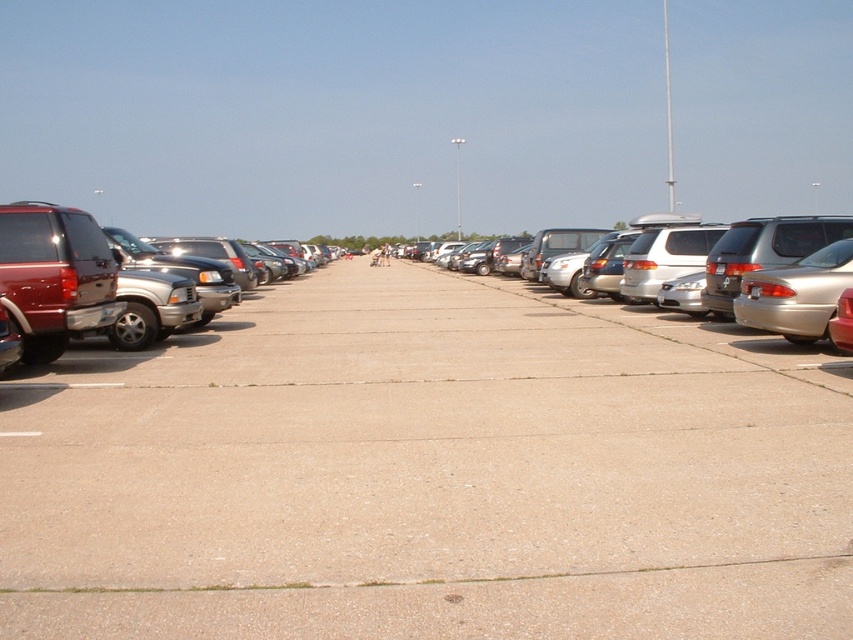
From the picture: Does silver metallic minivan at right have a lesser width compared to metallic silver sedan at right?

No.

Can you confirm if silver metallic minivan at right is positioned to the left of metallic silver sedan at right?

Incorrect, silver metallic minivan at right is not on the left side of metallic silver sedan at right.

Identify the location of silver metallic minivan at right. This screenshot has height=640, width=853. (779, 273).

What are the coordinates of `silver metallic minivan at right` in the screenshot? It's located at (779, 273).

Is gray concrete pavement at center behind metallic silver sedan at right?

No, gray concrete pavement at center is closer to the viewer.

Which of these two, gray concrete pavement at center or metallic silver sedan at right, stands shorter?

Standing shorter between the two is metallic silver sedan at right.

What do you see at coordinates (430, 474) in the screenshot?
I see `gray concrete pavement at center` at bounding box center [430, 474].

I want to click on gray concrete pavement at center, so tap(430, 474).

Between shiny metallic suv at left and metallic silver sedan at right, which one is positioned lower?

shiny metallic suv at left is below.

Is point (44, 205) farther from camera compared to point (750, 314)?

No, it is in front of (750, 314).

Find the location of a particular element. shiny metallic suv at left is located at coordinates point(55,275).